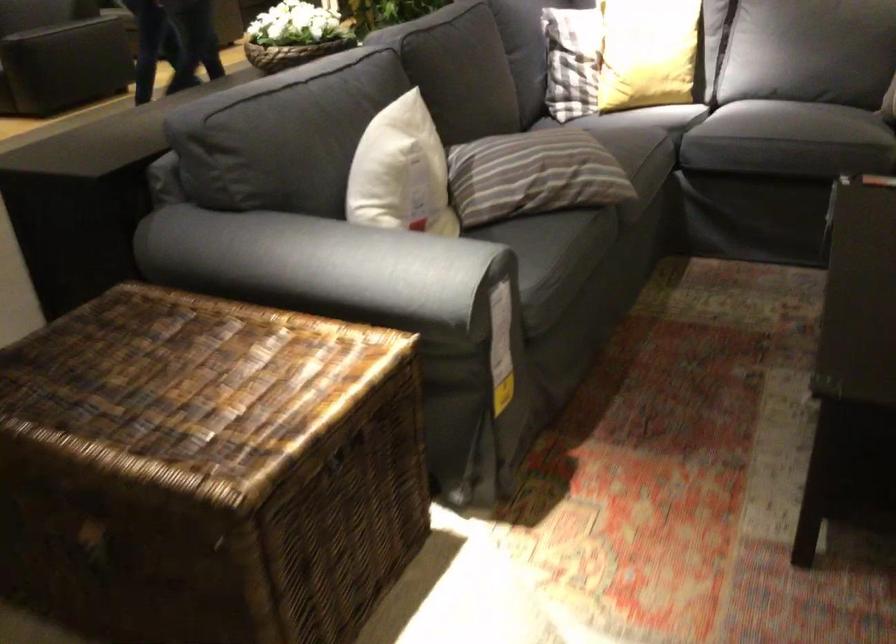
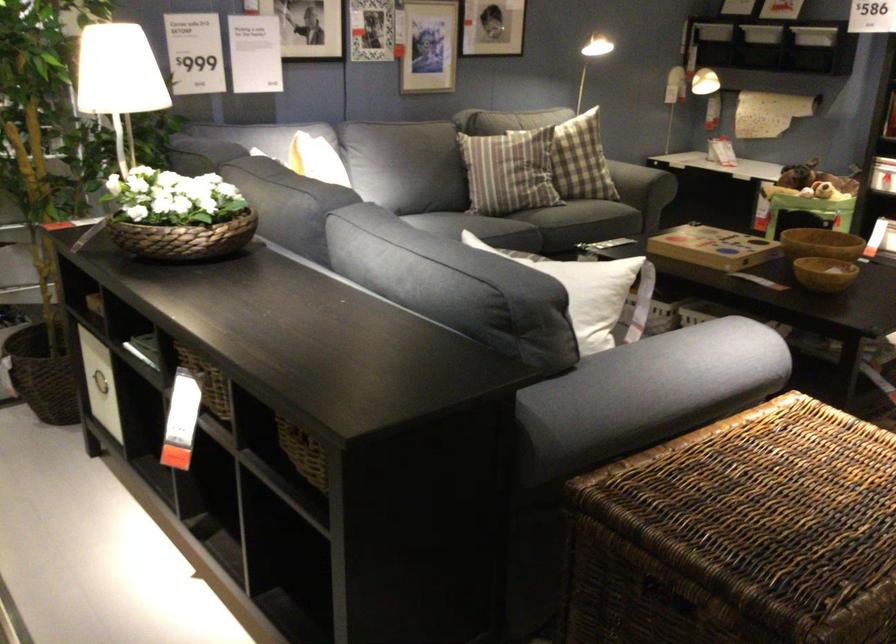
Question: I am providing you with two images of the same scene from different viewpoints. After the viewpoint changes to image2, which objects are now occluded?

Choices:
 (A) gray sofa armrest
 (B) wicker storage basket
 (C) striped pillow
 (D) pink folded cloth

Answer: (C)